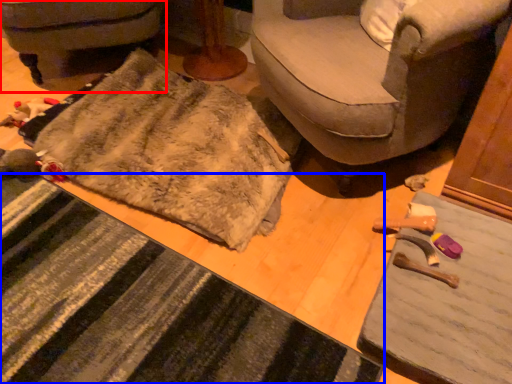
Question: Among these objects, which one is nearest to the camera, furniture (highlighted by a red box) or doormat (highlighted by a blue box)?

Choices:
 (A) furniture
 (B) doormat

Answer: (B)